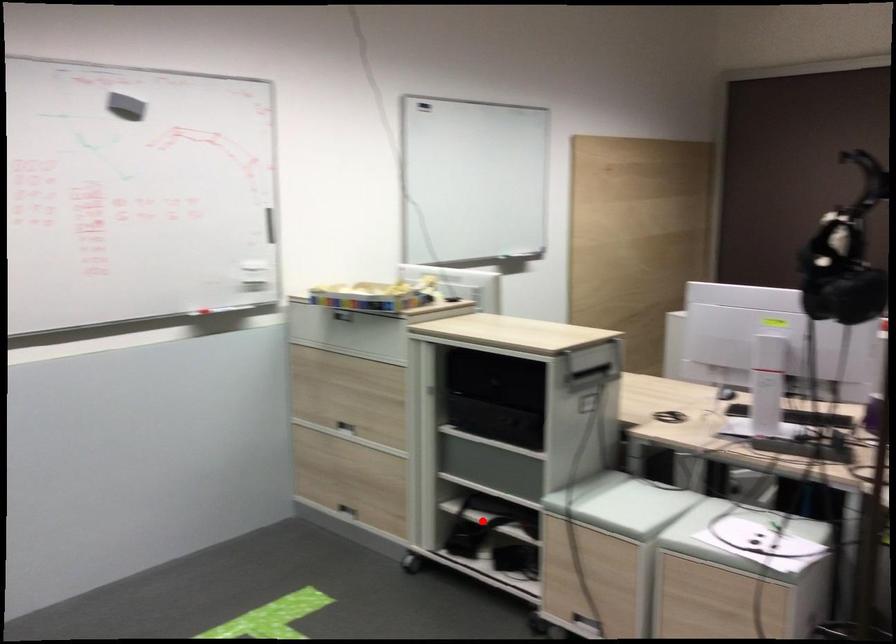
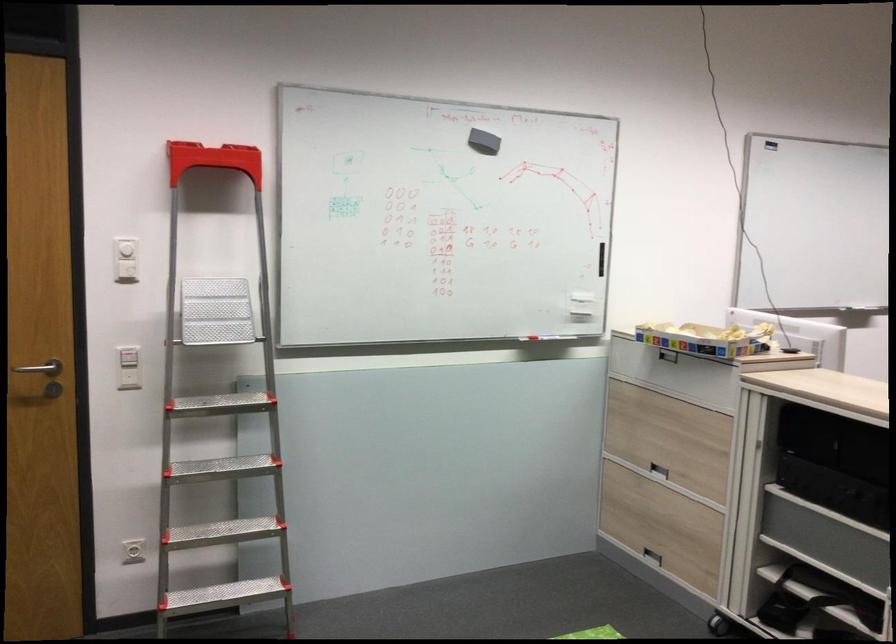
Find the pixel in the second image that matches the highlighted location in the first image.

(814, 603)